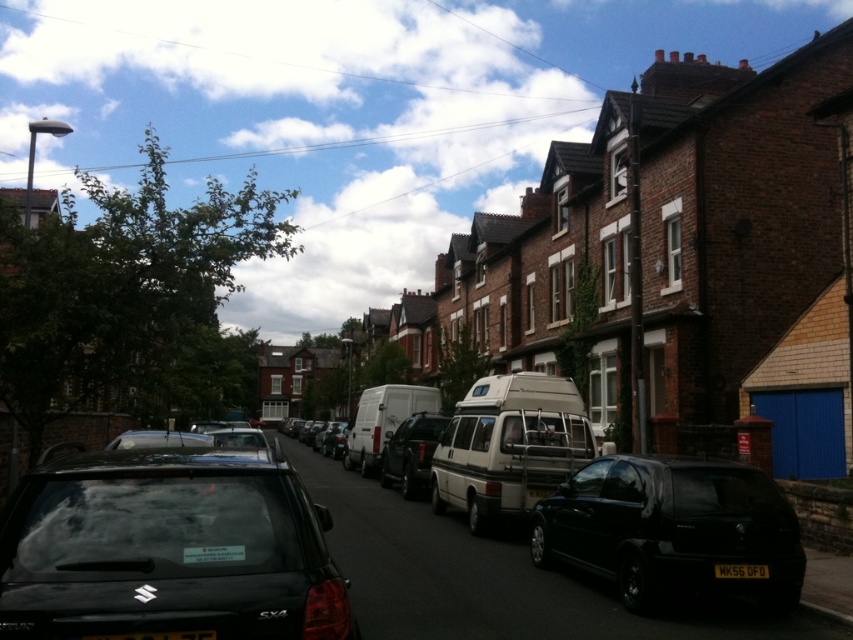
Question: Is white matte van at center further to camera compared to matte black van at center?

Choices:
 (A) no
 (B) yes

Answer: (B)

Question: Is black matte car at lower left to the right of beige metallic van at center from the viewer's perspective?

Choices:
 (A) yes
 (B) no

Answer: (B)

Question: Considering the real-world distances, which object is closest to the black matte car at lower left?

Choices:
 (A) white matte van at center
 (B) matte black van at center
 (C) shiny black car at center
 (D) beige metallic van at center

Answer: (D)

Question: Which point is closer to the camera taking this photo?

Choices:
 (A) (486, 445)
 (B) (762, 568)
 (C) (637, 460)
 (D) (395, 444)

Answer: (B)

Question: Is black matte hatchback at center thinner than matte black van at center?

Choices:
 (A) no
 (B) yes

Answer: (A)

Question: Based on their relative distances, which object is nearer to the shiny black car at center?

Choices:
 (A) black matte hatchback at center
 (B) black plastic license plate at lower right

Answer: (A)